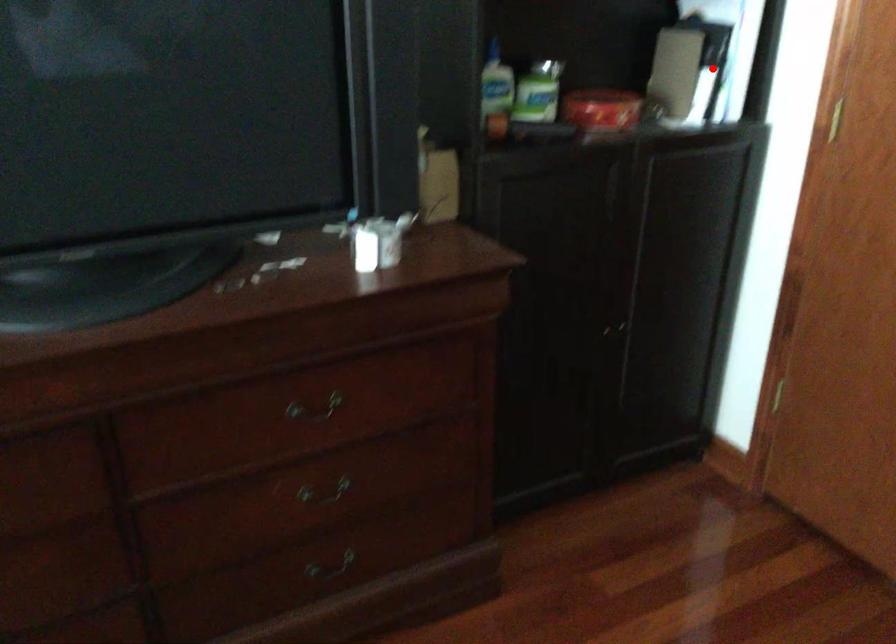
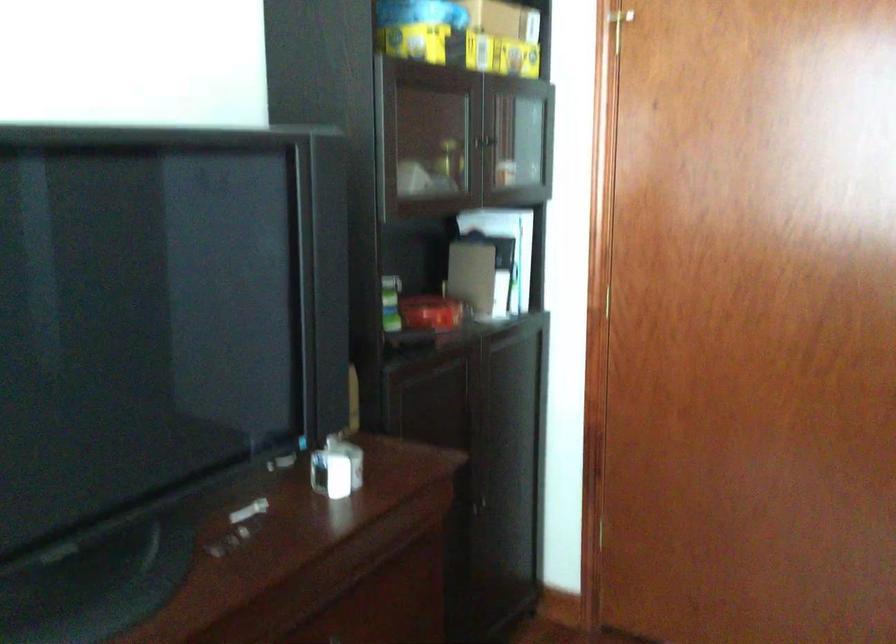
Where in the second image is the point corresponding to the highlighted location from the first image?

(503, 272)